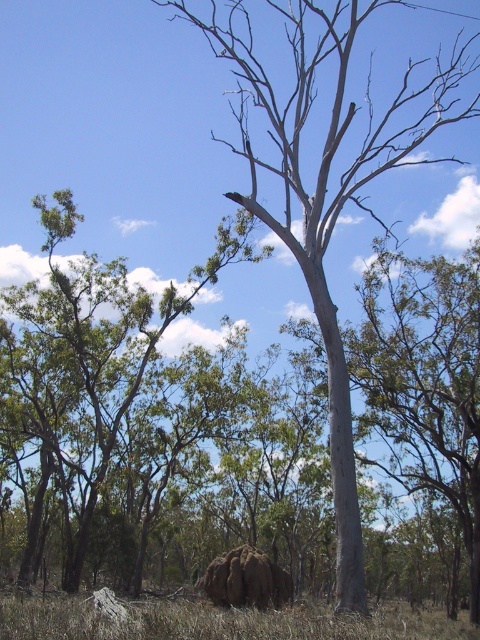
Measure the distance between point (307,280) and camera.

They are 18.67 meters apart.

Can you confirm if gray bark tree at center is positioned to the left of smooth grey tree trunk at center?

Correct, you'll find gray bark tree at center to the left of smooth grey tree trunk at center.

Looking at this image, measure the distance between point [372,124] and camera.

48.89 meters

Locate an element on the screen. gray bark tree at center is located at coordinates (327, 176).

Who is more forward, (359, 109) or (127, 609)?

Point (127, 609)

Between gray bark tree at center and brown dry grass at lower center, which one has less height?

With less height is brown dry grass at lower center.

Which is behind, point (259, 164) or point (256, 636)?

The point (259, 164) is more distant.

Image resolution: width=480 pixels, height=640 pixels. I want to click on gray bark tree at center, so click(x=327, y=176).

Which is more to the right, green leafy tree at left or brown dry grass at lower center?

brown dry grass at lower center is more to the right.

Is green leafy tree at left to the right of brown dry grass at lower center from the viewer's perspective?

Incorrect, green leafy tree at left is not on the right side of brown dry grass at lower center.

Where is `green leafy tree at left`? The width and height of the screenshot is (480, 640). green leafy tree at left is located at coordinates (87, 358).

Identify the location of green leafy tree at left. (87, 358).